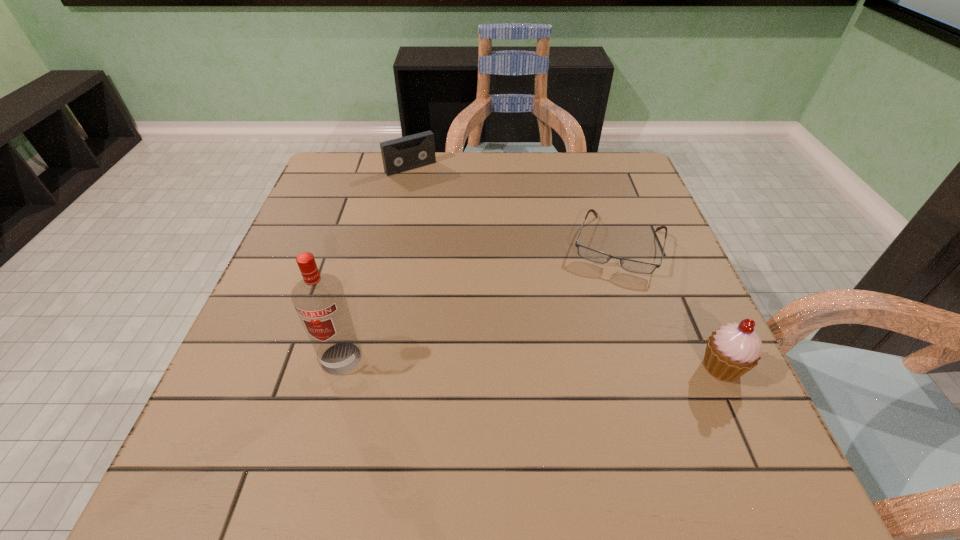
Where is `free space that satisfies the following two spatial constraints: 1. on the front side of the cupcake; 2. on the left side of the second shortest object`? The width and height of the screenshot is (960, 540). free space that satisfies the following two spatial constraints: 1. on the front side of the cupcake; 2. on the left side of the second shortest object is located at coordinates (369, 367).

At what (x,y) coordinates should I click in order to perform the action: click on vacant space that satisfies the following two spatial constraints: 1. on the front side of the spectacles; 2. on the right side of the videotape. Please return your answer as a coordinate pair (x, y). Looking at the image, I should click on (395, 245).

At what (x,y) coordinates should I click in order to perform the action: click on free space that satisfies the following two spatial constraints: 1. on the front label of the vodka; 2. on the left side of the third shortest object. Please return your answer as a coordinate pair (x, y). Looking at the image, I should click on click(x=339, y=367).